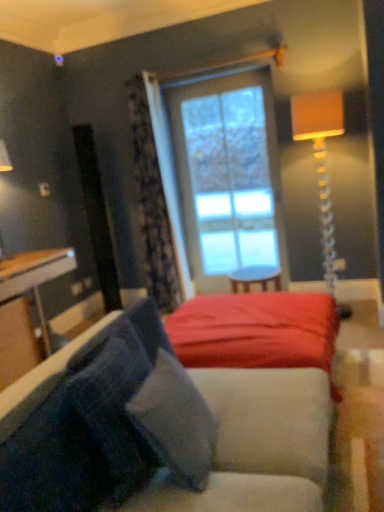
Question: Does point (72, 355) appear closer or farther from the camera than point (264, 146)?

Choices:
 (A) farther
 (B) closer

Answer: (B)

Question: Relative to clear glass window at center, is velvety blue pillow at lower left, acting as the first pillow starting from the left, in front or behind?

Choices:
 (A) front
 (B) behind

Answer: (A)

Question: Considering the real-world distances, which object is farthest from the wooden round table at center, arranged as the first table when viewed from the right?

Choices:
 (A) wooden table at left, the 2th table viewed from the right
 (B) smooth red fabric bed at center
 (C) patterned fabric curtain at upper center
 (D) orange fabric lampshade at upper right
 (E) velvety blue pillow at lower left, acting as the first pillow starting from the left

Answer: (E)

Question: Considering the real-world distances, which object is farthest from the clear glass window at center?

Choices:
 (A) patterned fabric curtain at upper center
 (B) wooden table at left, the 2th table viewed from the right
 (C) velvety gray pillow at lower left, which is the second pillow from left to right
 (D) orange fabric lampshade at upper right
 (E) velvety blue pillow at lower left, acting as the first pillow starting from the left

Answer: (E)